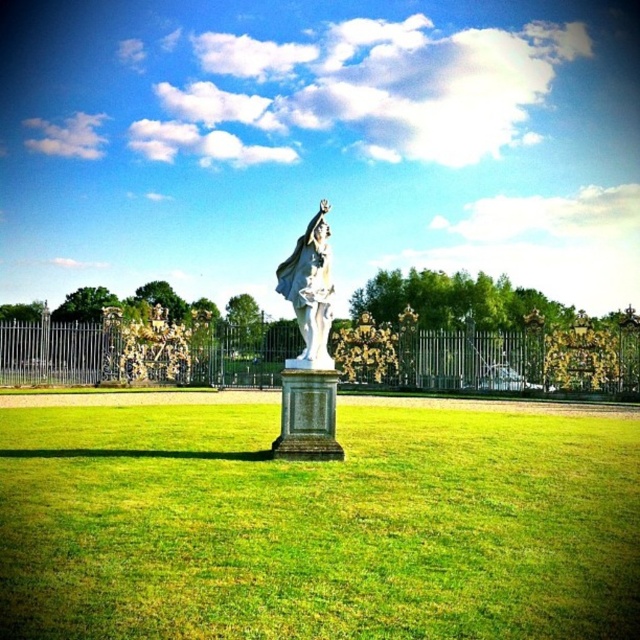
You are a gardener who needs to water the green grass at center and the white marble statue at center. Since the statue is in the way, which direction should you move it to access the grass?

The green grass at center is on the left side of the white marble statue at center, so you should move the statue to the right to access the grass on the left.